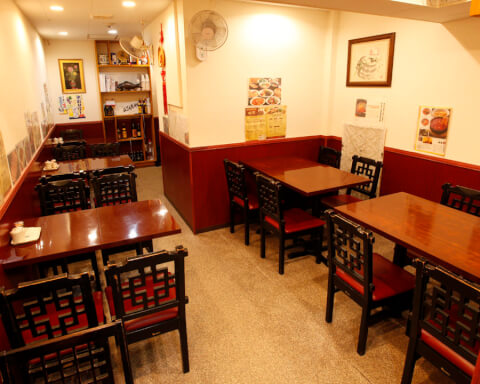
This screenshot has height=384, width=480. I want to click on shelf, so click(139, 115).